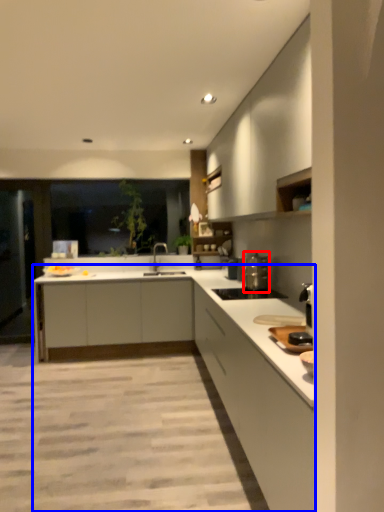
Question: Which of the following is the closest to the observer, appliance (highlighted by a red box) or countertop (highlighted by a blue box)?

Choices:
 (A) appliance
 (B) countertop

Answer: (B)